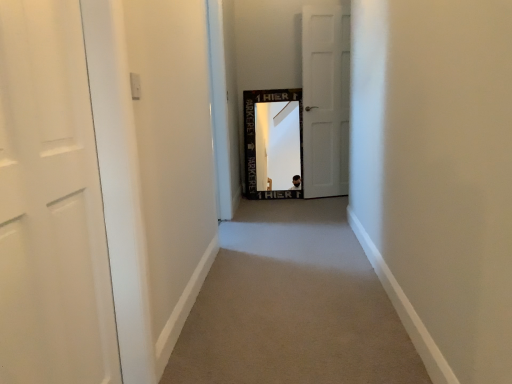
Question: Is white matte door at center, the first door from the right, oriented away from white matte door at left, arranged as the 1th door when viewed from the left?

Choices:
 (A) no
 (B) yes

Answer: (A)

Question: Is white matte door at center, the first door from the right, shorter than white matte door at left, marked as the 1th door in a front-to-back arrangement?

Choices:
 (A) yes
 (B) no

Answer: (B)

Question: From the image's perspective, is white matte door at center, which is the second door in left-to-right order, under white matte door at left, arranged as the 1th door when viewed from the left?

Choices:
 (A) yes
 (B) no

Answer: (B)

Question: Can we say white matte door at center, the 1th door from the back, lies outside white matte door at left, marked as the 1th door in a front-to-back arrangement?

Choices:
 (A) no
 (B) yes

Answer: (B)

Question: Is white matte door at center, the 1th door from the back, taller than white matte door at left, positioned as the 2th door in back-to-front order?

Choices:
 (A) no
 (B) yes

Answer: (B)

Question: From a real-world perspective, is white matte door at center, the first door from the right, below white matte door at left, which appears as the second door when viewed from the right?

Choices:
 (A) yes
 (B) no

Answer: (B)

Question: Is carpet at center to the right of white matte door at left, which appears as the second door when viewed from the right, from the viewer's perspective?

Choices:
 (A) yes
 (B) no

Answer: (A)

Question: From the image's perspective, is carpet at center under white matte door at left, positioned as the 2th door in back-to-front order?

Choices:
 (A) no
 (B) yes

Answer: (B)

Question: Can you confirm if carpet at center is taller than white matte door at left, marked as the 1th door in a front-to-back arrangement?

Choices:
 (A) yes
 (B) no

Answer: (B)

Question: Is carpet at center further to camera compared to white matte door at left, positioned as the 2th door in back-to-front order?

Choices:
 (A) yes
 (B) no

Answer: (A)

Question: Is carpet at center placed right next to white matte door at left, marked as the 1th door in a front-to-back arrangement?

Choices:
 (A) no
 (B) yes

Answer: (A)

Question: Is carpet at center to the left of white matte door at left, marked as the 1th door in a front-to-back arrangement, from the viewer's perspective?

Choices:
 (A) no
 (B) yes

Answer: (A)

Question: From the image's perspective, is white matte door at center, which is the second door in left-to-right order, on carpet at center?

Choices:
 (A) yes
 (B) no

Answer: (A)